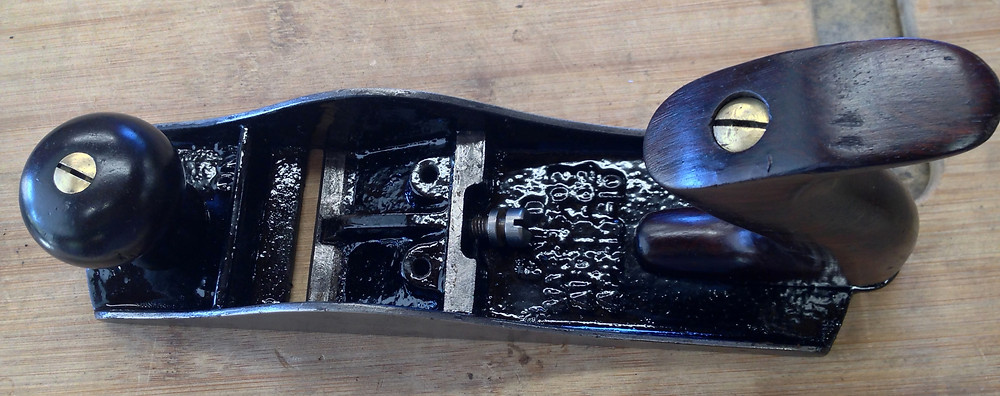
Locate an element on the screen. bar is located at coordinates (394, 217).